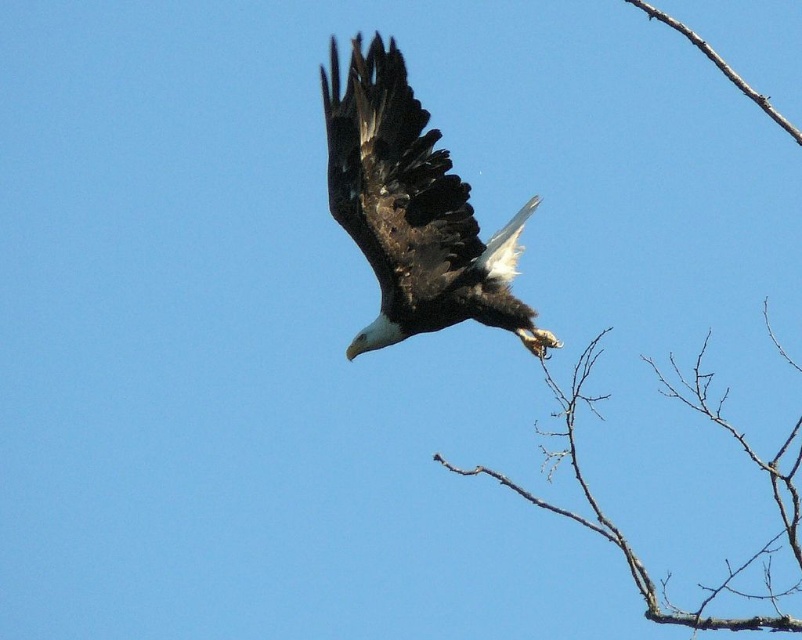
Is point (404, 323) farther from viewer compared to point (432, 458)?

That is True.

Is dark brown feathers at center to the right of brown twig at upper right from the viewer's perspective?

Incorrect, dark brown feathers at center is not on the right side of brown twig at upper right.

Locate an element on the screen. dark brown feathers at center is located at coordinates (412, 211).

Which is more to the left, brown twig at upper right or brown rough branch at upper right?

brown twig at upper right

Can you confirm if brown twig at upper right is positioned below brown rough branch at upper right?

Indeed, brown twig at upper right is positioned under brown rough branch at upper right.

Image resolution: width=802 pixels, height=640 pixels. I want to click on brown twig at upper right, so point(622,534).

The image size is (802, 640). I want to click on brown twig at upper right, so click(622, 534).

Which is below, dark brown feathers at center or brown rough branch at upper right?

dark brown feathers at center

Can you confirm if dark brown feathers at center is positioned to the left of brown rough branch at upper right?

Yes, dark brown feathers at center is to the left of brown rough branch at upper right.

The height and width of the screenshot is (640, 802). I want to click on dark brown feathers at center, so click(412, 211).